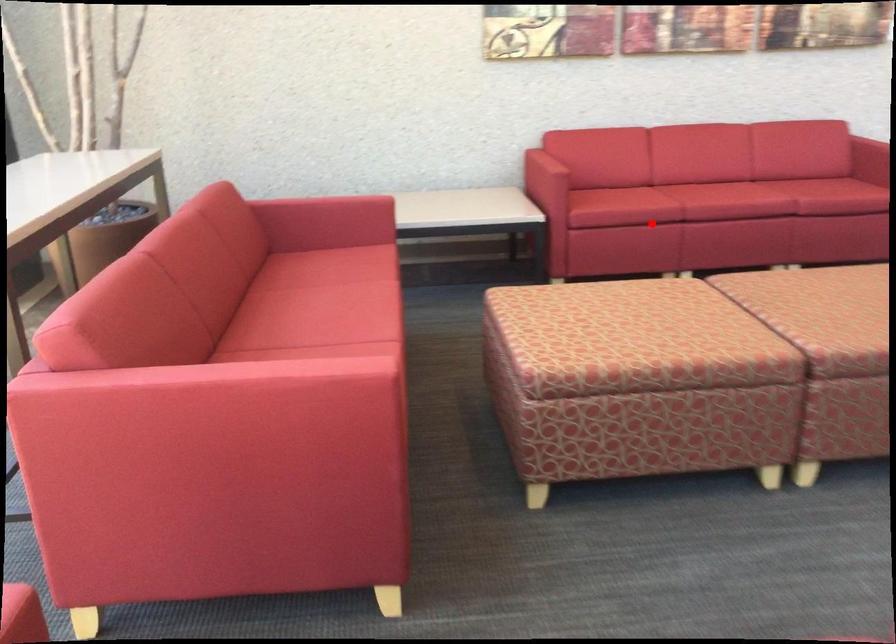
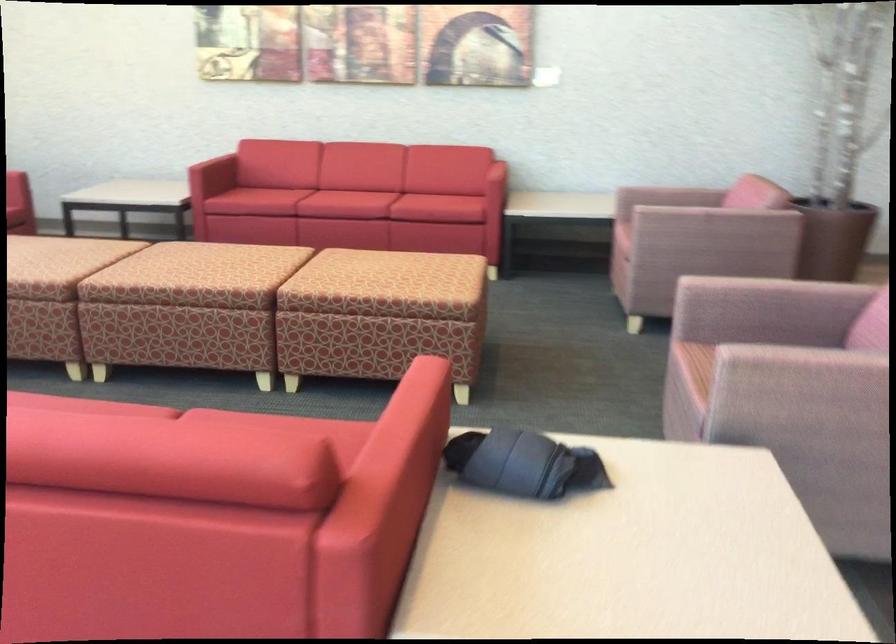
The point at the highlighted location is marked in the first image. Where is the corresponding point in the second image?

(265, 200)